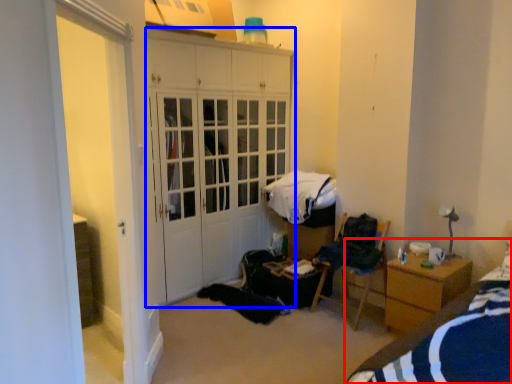
Question: Which object appears closest to the camera in this image, bed (highlighted by a red box) or cabinetry (highlighted by a blue box)?

Choices:
 (A) bed
 (B) cabinetry

Answer: (A)